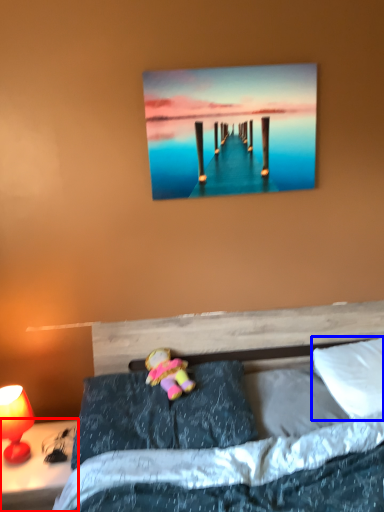
Question: Which object is further to the camera taking this photo, nightstand (highlighted by a red box) or pillow (highlighted by a blue box)?

Choices:
 (A) nightstand
 (B) pillow

Answer: (B)